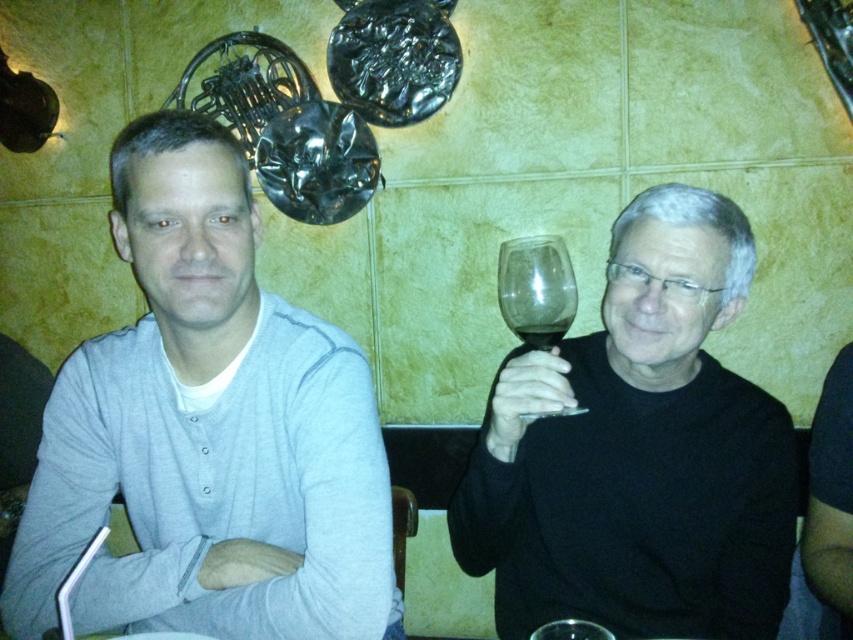
You are a photographer trying to capture a candid shot of both the gray cotton shirt at left and the transparent glass at right. Since you can only focus on one subject at a time, which object should you focus on to ensure the other remains in the background?

You should focus on the gray cotton shirt at left because the transparent glass at right is behind it, so keeping the gray cotton shirt at left in focus will place the transparent glass at right naturally in the background.

You are a waiter at a restaurant and need to place a new wine glass exactly where the black matte wine glass at right is currently positioned. What are the coordinates where you should place the new wine glass?

The black matte wine glass at right is located at point (637, 451), so you should place the new wine glass at those coordinates.